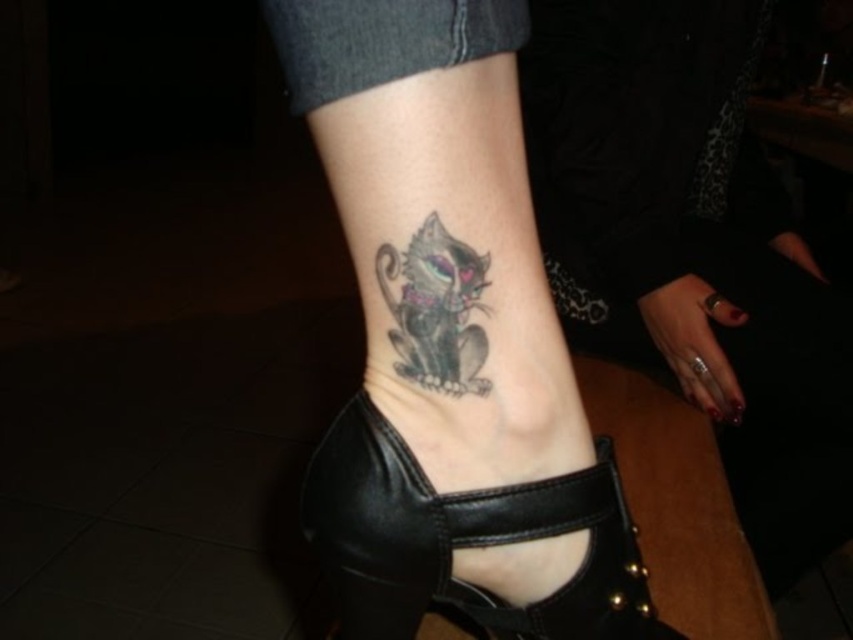
Can you confirm if black leather sandal at lower center is thinner than shiny black cat at lower center?

In fact, black leather sandal at lower center might be wider than shiny black cat at lower center.

Is black leather sandal at lower center wider than shiny black cat at lower center?

Correct, the width of black leather sandal at lower center exceeds that of shiny black cat at lower center.

Based on the photo, measure the distance between point (392,570) and camera.

A distance of 13.22 inches exists between point (392,570) and camera.

The image size is (853, 640). In order to click on black leather sandal at lower center in this screenshot , I will do `click(463, 540)`.